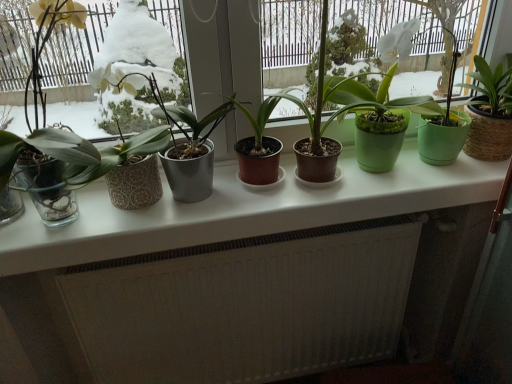
Identify the location of vacant area that lies between transparent glass window at left and metallic gray pot at center, arranged as the first houseplant when viewed from the left. The image size is (512, 384). (207, 216).